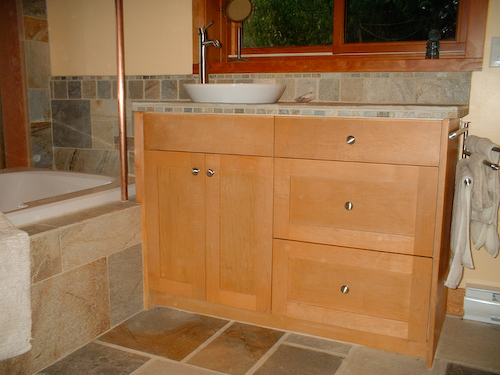
Image resolution: width=500 pixels, height=375 pixels. What are the coordinates of `sink` in the screenshot? It's located at (204, 85).